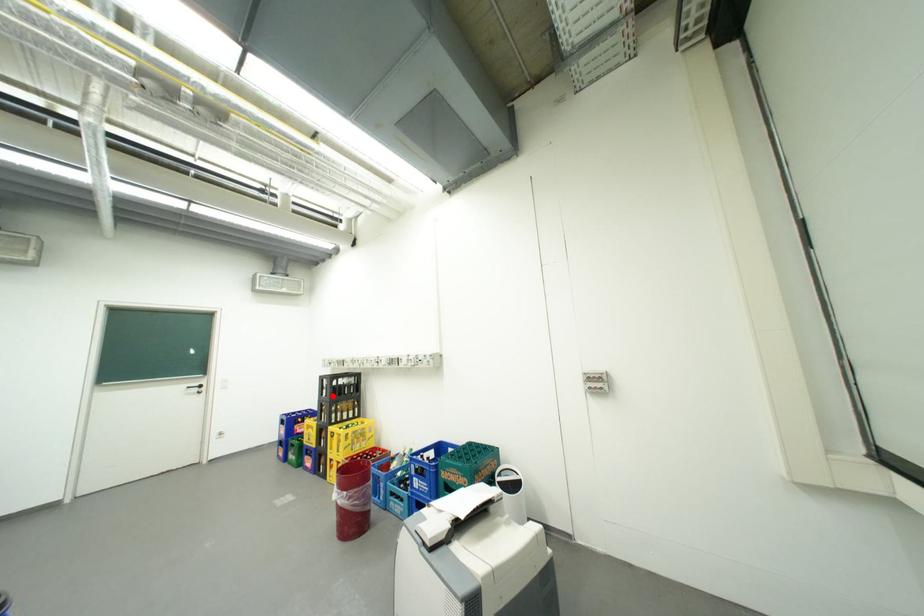
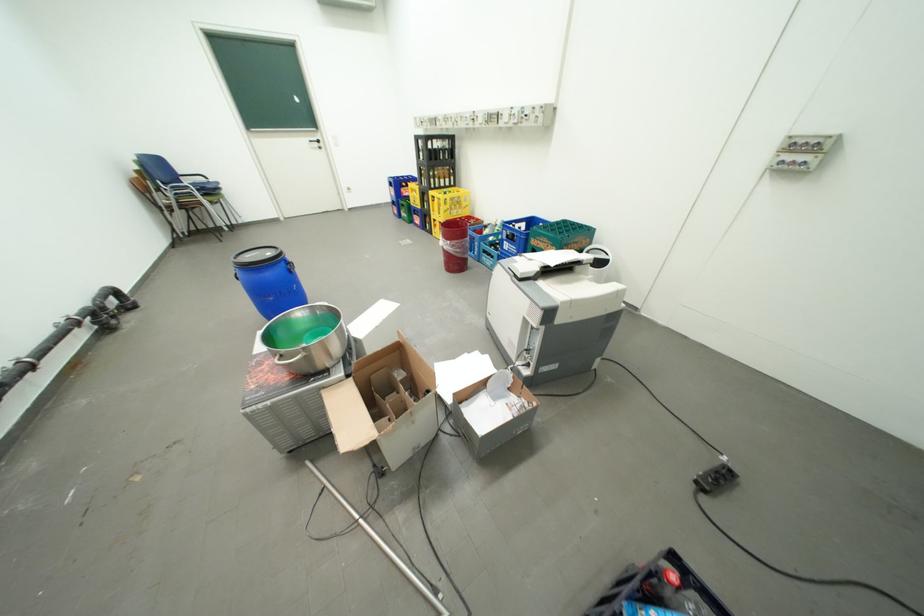
The point at the highlighted location is marked in the first image. Where is the corresponding point in the second image?

(430, 159)